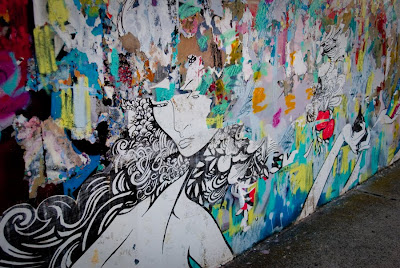
The image size is (400, 268). I want to click on painted wall, so click(383, 148), click(276, 46), click(89, 42), click(81, 118).